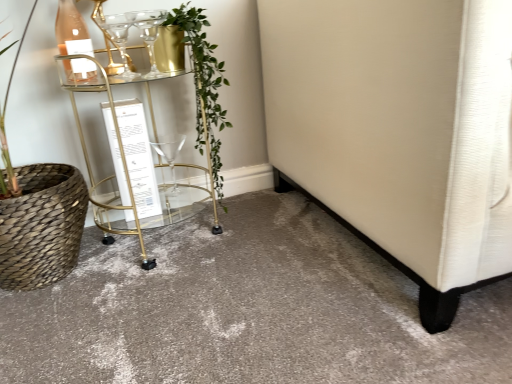
Question: Is clear glass wine glass at center, the 1th wine glass viewed from the back, behind green leafy plant at center?

Choices:
 (A) no
 (B) yes

Answer: (B)

Question: Does clear glass wine glass at center, the 1th wine glass viewed from the back, have a smaller size compared to green leafy plant at center?

Choices:
 (A) no
 (B) yes

Answer: (B)

Question: Can you confirm if clear glass wine glass at center, the 1th wine glass viewed from the back, is taller than green leafy plant at center?

Choices:
 (A) no
 (B) yes

Answer: (A)

Question: Is clear glass wine glass at center, acting as the second wine glass starting from the top, not near green leafy plant at center?

Choices:
 (A) yes
 (B) no

Answer: (B)

Question: From the image's perspective, is clear glass wine glass at center, the 1th wine glass viewed from the back, located beneath green leafy plant at center?

Choices:
 (A) yes
 (B) no

Answer: (A)

Question: Can you confirm if clear glass wine glass at center, acting as the second wine glass starting from the top, is positioned to the left of green leafy plant at center?

Choices:
 (A) yes
 (B) no

Answer: (A)

Question: Is clear glass wine glass at upper left, the first wine glass in the front-to-back sequence, aimed at clear glass wine glass at center, acting as the 2th wine glass starting from the front?

Choices:
 (A) yes
 (B) no

Answer: (B)

Question: Is clear glass wine glass at center, acting as the second wine glass starting from the top, surrounded by clear glass wine glass at upper left, the 2th wine glass from the bottom?

Choices:
 (A) yes
 (B) no

Answer: (B)

Question: Considering the relative positions of clear glass wine glass at upper left, positioned as the 2th wine glass in back-to-front order, and clear glass wine glass at center, which is the first wine glass in bottom-to-top order, in the image provided, is clear glass wine glass at upper left, positioned as the 2th wine glass in back-to-front order, in front of clear glass wine glass at center, which is the first wine glass in bottom-to-top order,?

Choices:
 (A) yes
 (B) no

Answer: (A)

Question: From the image's perspective, is clear glass wine glass at upper left, the first wine glass in the front-to-back sequence, under clear glass wine glass at center, which is the first wine glass in bottom-to-top order?

Choices:
 (A) no
 (B) yes

Answer: (A)

Question: From a real-world perspective, is clear glass wine glass at upper left, the 2th wine glass from the bottom, located beneath clear glass wine glass at center, which is the first wine glass in bottom-to-top order?

Choices:
 (A) yes
 (B) no

Answer: (B)

Question: Is clear glass wine glass at upper left, positioned as the 2th wine glass in back-to-front order, not inside clear glass wine glass at center, the 1th wine glass viewed from the back?

Choices:
 (A) no
 (B) yes

Answer: (B)

Question: Does clear glass wine glass at upper left, positioned as the 2th wine glass in back-to-front order, have a lesser width compared to green leafy plant at center?

Choices:
 (A) yes
 (B) no

Answer: (A)